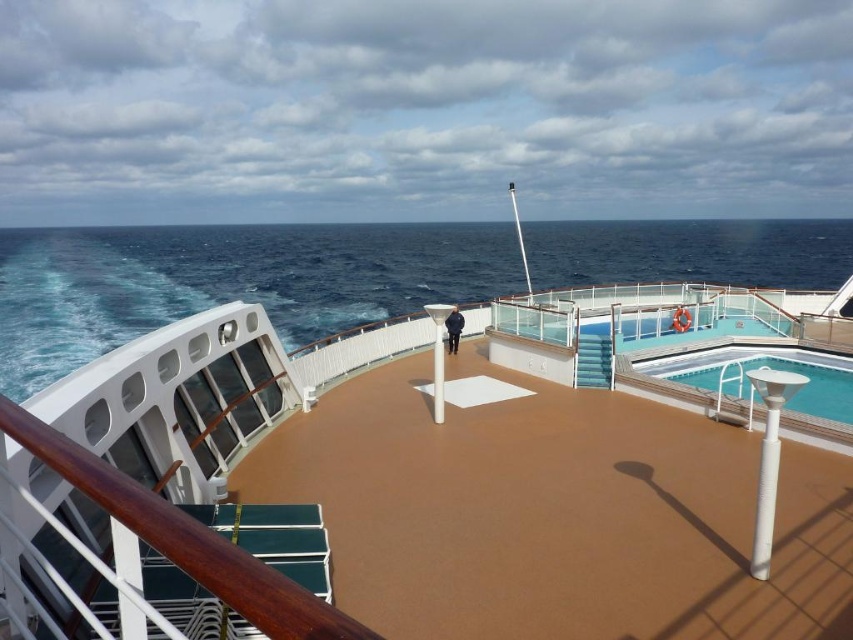
Is blue water at upper left to the right of dark blue uniform at center from the viewer's perspective?

Correct, you'll find blue water at upper left to the right of dark blue uniform at center.

What do you see at coordinates (227, 282) in the screenshot? I see `blue water at upper left` at bounding box center [227, 282].

This screenshot has height=640, width=853. What are the coordinates of `blue water at upper left` in the screenshot? It's located at (227, 282).

The image size is (853, 640). In order to click on blue water at upper left in this screenshot , I will do `click(227, 282)`.

Is brown rubber deck at center in front of dark blue uniform at center?

Yes, it is.

Is brown rubber deck at center shorter than dark blue uniform at center?

No.

Find the location of a particular element. brown rubber deck at center is located at coordinates (202, 394).

Does blue water at upper left have a greater height compared to brown rubber deck at center?

Indeed, blue water at upper left has a greater height compared to brown rubber deck at center.

Find the location of a particular element. Image resolution: width=853 pixels, height=640 pixels. blue water at upper left is located at coordinates (227, 282).

Find the location of a particular element. blue water at upper left is located at coordinates (227, 282).